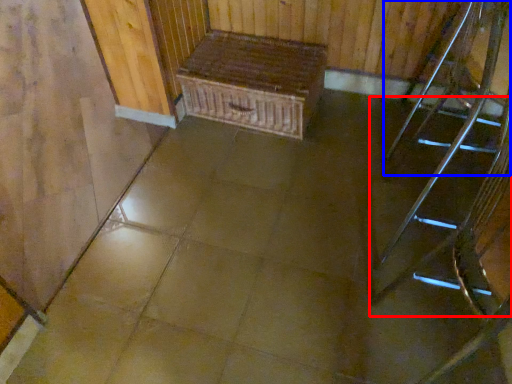
Question: Which point is further to the camera, stairs (highlighted by a red box) or chair (highlighted by a blue box)?

Choices:
 (A) stairs
 (B) chair

Answer: (B)